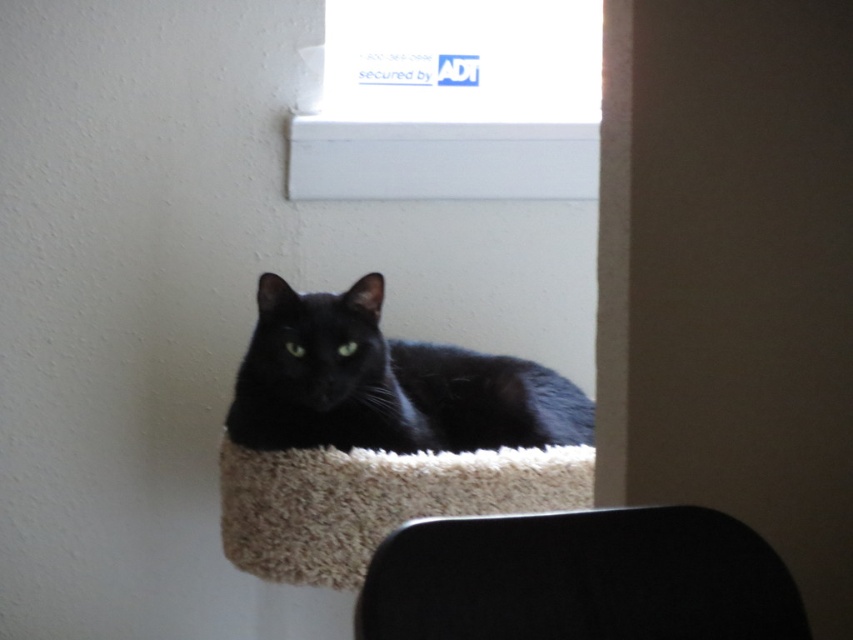
From the picture: You are a visitor at this house and want to sit down near the beige fluffy cat bed at center. Is the smooth black chair at lower center located to the right side of the cat bed?

Yes, the smooth black chair at lower center is to the right of the beige fluffy cat bed at center, so you can sit there.

From the picture: You are a window cleaner standing at the camera position. You need to clean the white plastic window sill at upper center. You have a 1.5 meter long pole. Can you reach it?

The distance between the white plastic window sill at upper center and the camera is 1.84 meters. Since your pole is only 1.5 meters long, you cannot reach the white plastic window sill at upper center from the camera position.

You are a cat owner who wants to place a new smooth black chair at lower center in your living room. The current beige fluffy cat bed at center is already there. Based on the scene, where should you place the new chair relative to the existing cat bed?

The smooth black chair at lower center should be placed above the beige fluffy cat bed at center as per the scene description.